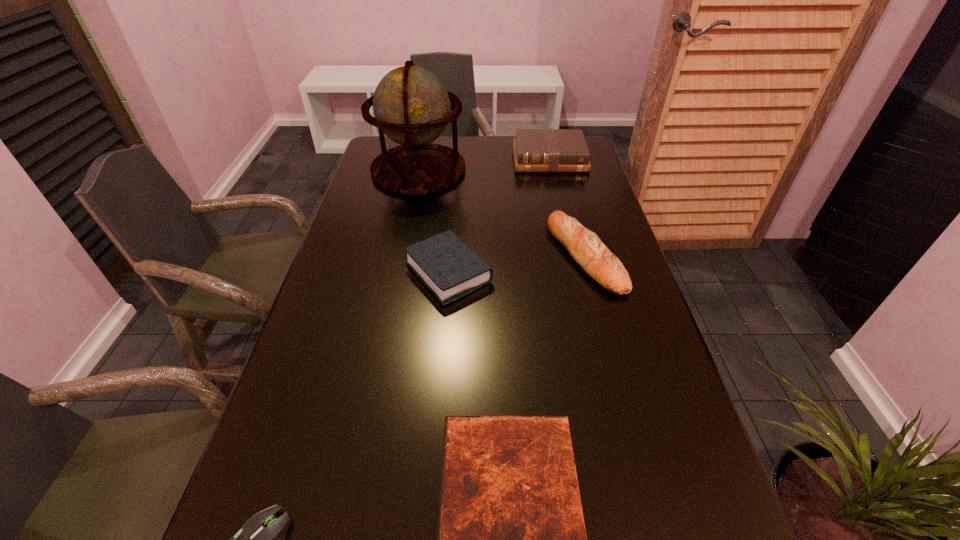
At what (x,y) coordinates should I click in order to perform the action: click on unoccupied area between the tallest object and the farthest Bible. Please return your answer as a coordinate pair (x, y). Looking at the image, I should click on (484, 164).

I want to click on vacant area that lies between the tallest object and the second farthest Bible, so click(434, 221).

Where is `vacant region between the tallest object and the baguet`? vacant region between the tallest object and the baguet is located at coordinates 502,213.

Select which object is the closest to the second farthest Bible. Please provide its 2D coordinates. Your answer should be formatted as a tuple, i.e. [(x, y)], where the tuple contains the x and y coordinates of a point satisfying the conditions above.

[(585, 247)]

You are a GUI agent. You are given a task and a screenshot of the screen. Output one action in this format:
    pyautogui.click(x=<x>, y=<y>)
    Task: Click on the object that stands as the fourth closest to the computer mouse
    
    Given the screenshot: What is the action you would take?
    point(411,105)

Locate which Bible is the third closest to the baguet. Please provide its 2D coordinates. Your answer should be formatted as a tuple, i.e. [(x, y)], where the tuple contains the x and y coordinates of a point satisfying the conditions above.

[(511, 539)]

Identify the location of Bible that stands as the third closest to the shortest object. (535, 150).

Find the location of `free space in the image that satisfies the following two spatial constraints: 1. on the spine side of the farthest Bible; 2. on the left side of the baguet`. free space in the image that satisfies the following two spatial constraints: 1. on the spine side of the farthest Bible; 2. on the left side of the baguet is located at coordinates (572, 255).

I want to click on vacant region that satisfies the following two spatial constraints: 1. on the front-facing side of the second farthest Bible; 2. on the right side of the globe, so click(397, 273).